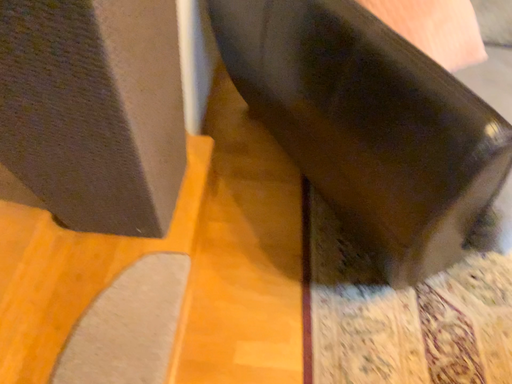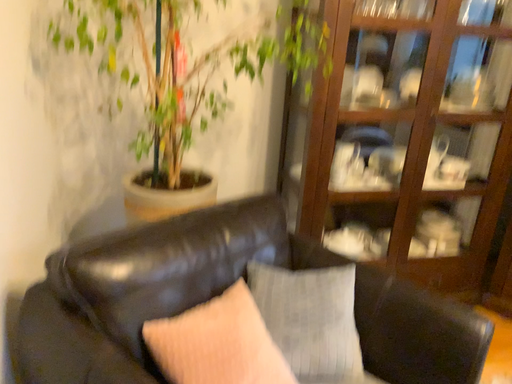
Question: How did the camera likely rotate when shooting the video?

Choices:
 (A) rotated left
 (B) rotated right

Answer: (B)